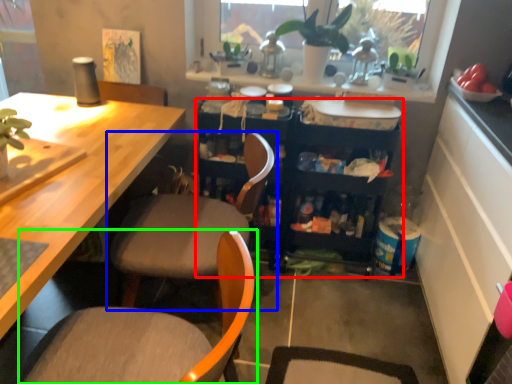
Question: Estimate the real-world distances between objects in this image. Which object is farther from cabinetry (highlighted by a red box), chair (highlighted by a blue box) or chair (highlighted by a green box)?

Choices:
 (A) chair
 (B) chair

Answer: (B)